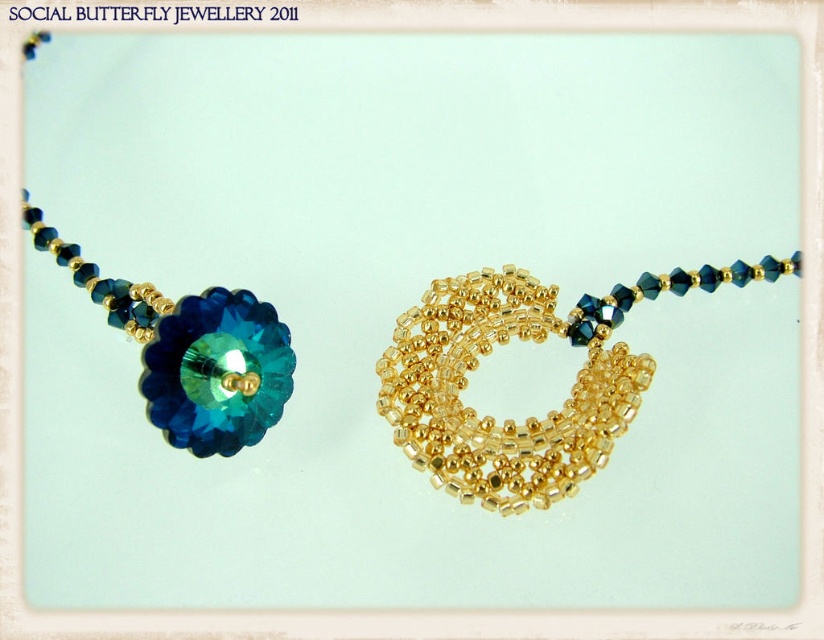
Which of these two, gold textured beads at center or teal crystal flower at left, stands taller?

teal crystal flower at left is taller.

Identify the location of gold textured beads at center. Image resolution: width=824 pixels, height=640 pixels. (528, 417).

Find the location of a particular element. The image size is (824, 640). gold textured beads at center is located at coordinates (528, 417).